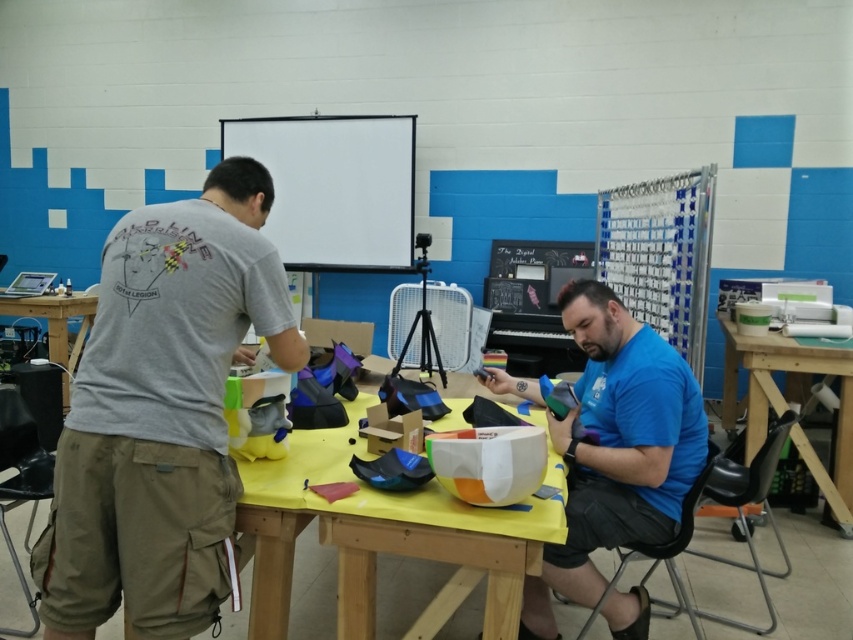
Question: Which point is farther to the camera?

Choices:
 (A) blue matte shirt at center
 (B) yellow matte table at center

Answer: (A)

Question: Which point is closer to the camera?

Choices:
 (A) green plastic chair at right
 (B) gray cotton t-shirt at left
 (C) blue matte shirt at center

Answer: (B)

Question: Is blue matte shirt at center thinner than green plastic chair at right?

Choices:
 (A) no
 (B) yes

Answer: (A)

Question: Does blue matte shirt at center appear on the right side of yellow matte table at center?

Choices:
 (A) no
 (B) yes

Answer: (B)

Question: Does blue matte shirt at center appear over matte black table at left?

Choices:
 (A) no
 (B) yes

Answer: (A)

Question: Which of the following is the farthest from the observer?

Choices:
 (A) yellow matte table at center
 (B) gray cotton t-shirt at left
 (C) green plastic chair at right

Answer: (C)